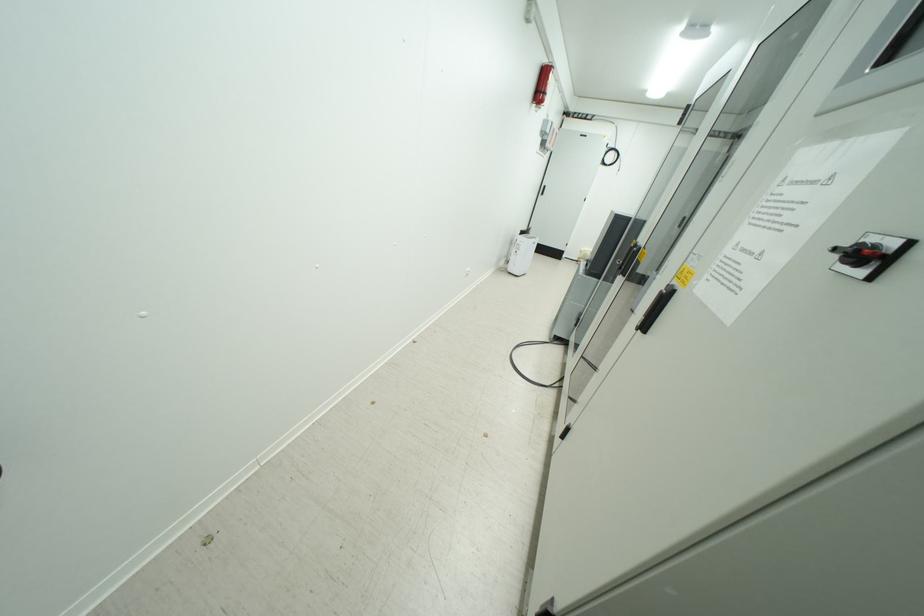
The height and width of the screenshot is (616, 924). I want to click on red and black switch, so click(x=541, y=84).